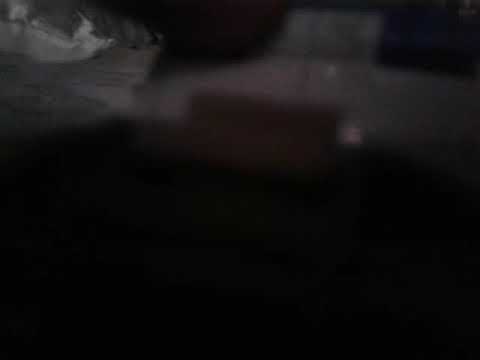
At what (x,y) coordinates should I click in order to perform the action: click on shadow of top of cabinet in background. Please return your answer as a coordinate pair (x, y). The width and height of the screenshot is (480, 360). Looking at the image, I should click on (439, 62).